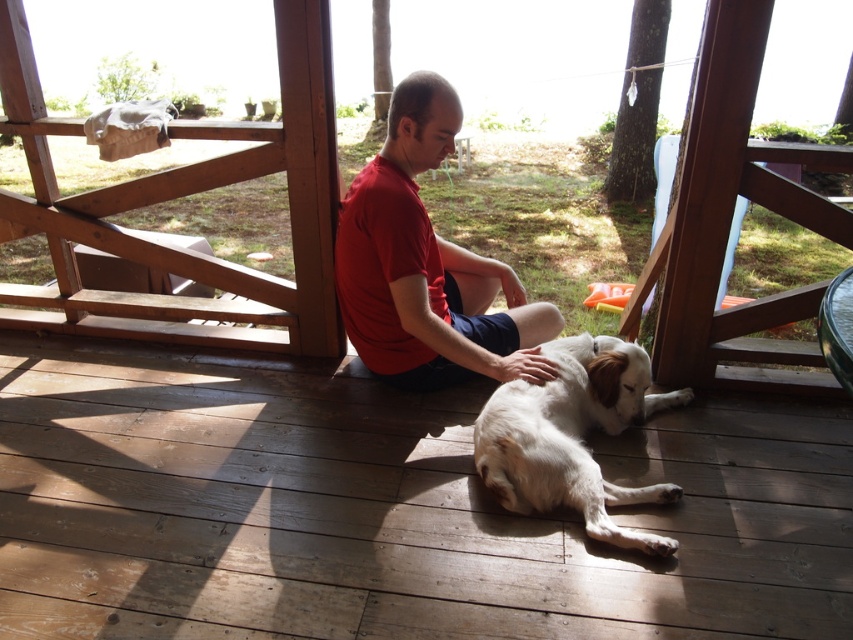
Question: Can you confirm if matte red shirt at center is bigger than white fur dog at center?

Choices:
 (A) no
 (B) yes

Answer: (B)

Question: Estimate the real-world distances between objects in this image. Which object is farther from the matte red shirt at center?

Choices:
 (A) wooden deck at center
 (B) white fur dog at center

Answer: (A)

Question: Where is wooden deck at center located in relation to matte red shirt at center in the image?

Choices:
 (A) right
 (B) left

Answer: (B)

Question: Can you confirm if wooden deck at center is thinner than white fur dog at center?

Choices:
 (A) yes
 (B) no

Answer: (B)

Question: Which object appears farthest from the camera in this image?

Choices:
 (A) matte red shirt at center
 (B) white fur dog at center
 (C) wooden deck at center

Answer: (A)

Question: Which point is farther to the camera?

Choices:
 (A) (549, 467)
 (B) (78, 634)

Answer: (A)